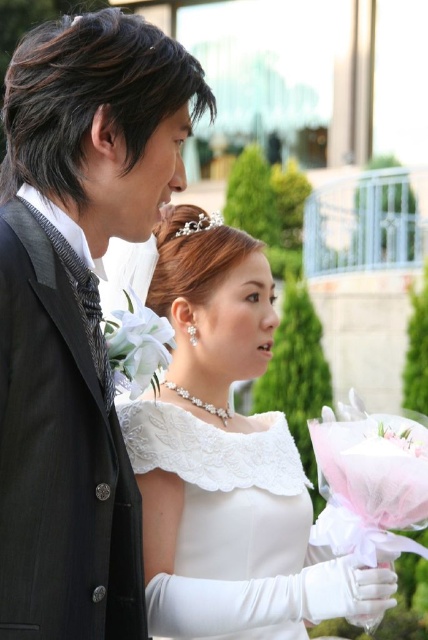
Does point (201, 630) come closer to viewer compared to point (258, 634)?

Yes, it is in front of point (258, 634).

How much distance is there between white lace dress at center and white lace wedding dress at center?

They are 16.38 inches apart.

The width and height of the screenshot is (428, 640). What are the coordinates of `white lace dress at center` in the screenshot? It's located at coord(226,461).

Does point (178, 86) lie in front of point (217, 225)?

Yes.

How far apart are matte black suit at left and pearl/textured hair accessory at upper center?

matte black suit at left is 3.30 meters from pearl/textured hair accessory at upper center.

Is point (118, 604) positioned in front of point (201, 221)?

Yes, it is in front of point (201, 221).

You are a GUI agent. You are given a task and a screenshot of the screen. Output one action in this format:
    pyautogui.click(x=<x>, y=<y>)
    Task: Click on the matte black suit at left
    Image resolution: width=428 pixels, height=640 pixels.
    Given the screenshot: What is the action you would take?
    pyautogui.click(x=77, y=310)

Does point (20, 496) come closer to viewer compared to point (231, 522)?

Yes.

Does matte black suit at left have a lesser height compared to white lace wedding dress at center?

Correct, matte black suit at left is not as tall as white lace wedding dress at center.

At what (x,y) coordinates should I click in order to perform the action: click on matte black suit at left. Please return your answer as a coordinate pair (x, y). The height and width of the screenshot is (640, 428). Looking at the image, I should click on (77, 310).

Identify the location of matte black suit at left. (77, 310).